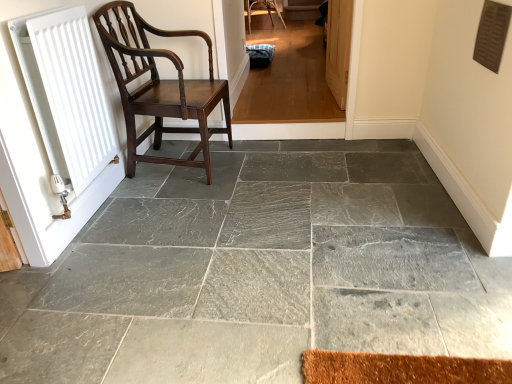
Question: Is wooden screen door at upper right thinner than white matte radiator at left?

Choices:
 (A) no
 (B) yes

Answer: (B)

Question: Would you say wooden screen door at upper right is a long distance from white matte radiator at left?

Choices:
 (A) yes
 (B) no

Answer: (A)

Question: Is wooden screen door at upper right taller than white matte radiator at left?

Choices:
 (A) yes
 (B) no

Answer: (B)

Question: From a real-world perspective, does wooden screen door at upper right sit lower than white matte radiator at left?

Choices:
 (A) yes
 (B) no

Answer: (A)

Question: Can you confirm if wooden screen door at upper right is shorter than white matte radiator at left?

Choices:
 (A) yes
 (B) no

Answer: (A)

Question: Is wooden screen door at upper right at the left side of white matte radiator at left?

Choices:
 (A) yes
 (B) no

Answer: (B)

Question: Can you confirm if gray stone floor at center is bigger than white matte radiator at left?

Choices:
 (A) no
 (B) yes

Answer: (B)

Question: Can we say gray stone floor at center lies outside white matte radiator at left?

Choices:
 (A) yes
 (B) no

Answer: (A)

Question: Does gray stone floor at center have a lesser height compared to white matte radiator at left?

Choices:
 (A) yes
 (B) no

Answer: (A)

Question: From the image's perspective, is gray stone floor at center over white matte radiator at left?

Choices:
 (A) yes
 (B) no

Answer: (B)

Question: From a real-world perspective, is gray stone floor at center below white matte radiator at left?

Choices:
 (A) yes
 (B) no

Answer: (A)

Question: Can you confirm if gray stone floor at center is smaller than white matte radiator at left?

Choices:
 (A) yes
 (B) no

Answer: (B)

Question: Does dark wood chair at left come behind gray stone floor at center?

Choices:
 (A) no
 (B) yes

Answer: (B)